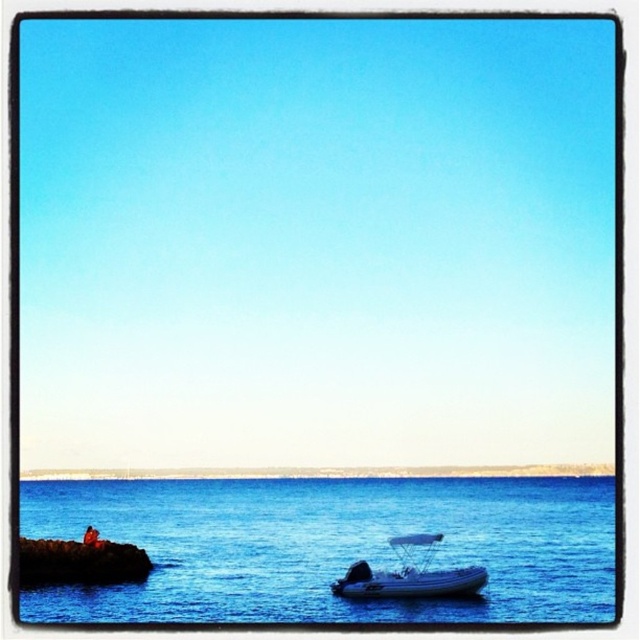
Question: Is blue water at lower left wider than white rubber boat at lower center?

Choices:
 (A) no
 (B) yes

Answer: (B)

Question: Among these points, which one is farthest from the camera?

Choices:
 (A) (342, 586)
 (B) (276, 579)

Answer: (B)

Question: Is blue water at lower left further to camera compared to white rubber boat at lower center?

Choices:
 (A) yes
 (B) no

Answer: (B)

Question: Does blue water at lower left have a greater width compared to white rubber boat at lower center?

Choices:
 (A) yes
 (B) no

Answer: (A)